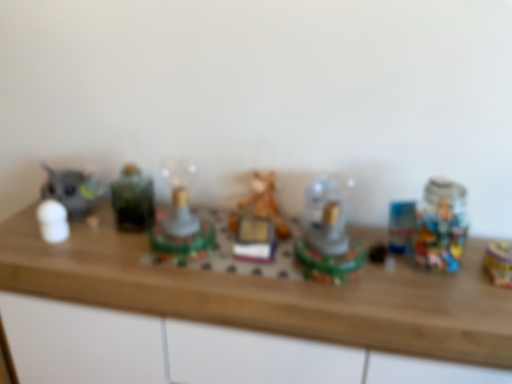
Measure the distance between matte gray cat at left, the second toy in the left-to-right sequence, and camera.

The depth of matte gray cat at left, the second toy in the left-to-right sequence, is 1.33 meters.

This screenshot has height=384, width=512. What do you see at coordinates (258, 221) in the screenshot?
I see `orange plush bear at center, which is the 5th toy from left to right` at bounding box center [258, 221].

Locate an element on the screen. This screenshot has width=512, height=384. translucent plastic toy at center, which is counted as the sixth toy, starting from the left is located at coordinates (327, 234).

What do you see at coordinates (180, 220) in the screenshot? I see `shiny green plastic toy at center, arranged as the fourth toy when viewed from the left` at bounding box center [180, 220].

Where is `green glass jar at left, placed as the 3th toy when sorted from left to right`? The width and height of the screenshot is (512, 384). green glass jar at left, placed as the 3th toy when sorted from left to right is located at coordinates (133, 199).

Relative to white matte figurine at left, the seventh toy in the right-to-left sequence, is green glass jar at left, the fifth toy from the right, in front or behind?

Clearly, green glass jar at left, the fifth toy from the right, is behind white matte figurine at left, the seventh toy in the right-to-left sequence.

Is green glass jar at left, the fifth toy from the right, not near white matte figurine at left, the first toy positioned from the left?

No, there isn't a large distance between green glass jar at left, the fifth toy from the right, and white matte figurine at left, the first toy positioned from the left.

Considering the relative sizes of green glass jar at left, placed as the 3th toy when sorted from left to right, and white matte figurine at left, the seventh toy in the right-to-left sequence, in the image provided, is green glass jar at left, placed as the 3th toy when sorted from left to right, bigger than white matte figurine at left, the seventh toy in the right-to-left sequence,?

Indeed, green glass jar at left, placed as the 3th toy when sorted from left to right, has a larger size compared to white matte figurine at left, the seventh toy in the right-to-left sequence.

In the scene shown: From the image's perspective, between green glass jar at left, placed as the 3th toy when sorted from left to right, and white matte figurine at left, the seventh toy in the right-to-left sequence, who is located below?

From the image's view, white matte figurine at left, the seventh toy in the right-to-left sequence, is below.

How far apart are orange plush bear at center, the third toy from the right, and gold metallic toy at right, which ranks as the 1th toy in right-to-left order?

orange plush bear at center, the third toy from the right, and gold metallic toy at right, which ranks as the 1th toy in right-to-left order, are 58.51 centimeters apart.

Is orange plush bear at center, which is the 5th toy from left to right, in front of gold metallic toy at right, the 7th toy positioned from the left?

No, orange plush bear at center, which is the 5th toy from left to right, is further to the viewer.

Is gold metallic toy at right, which ranks as the 1th toy in right-to-left order, inside orange plush bear at center, the third toy from the right?

No.

This screenshot has height=384, width=512. In order to click on the 3rd toy in front when counting from the orange plush bear at center, the third toy from the right in this screenshot , I will do `click(499, 262)`.

Is shiny green plastic toy at center, arranged as the fourth toy when viewed from the left, not inside translucent plastic toy at center, marked as the 2th toy in a right-to-left arrangement?

shiny green plastic toy at center, arranged as the fourth toy when viewed from the left, is positioned outside translucent plastic toy at center, marked as the 2th toy in a right-to-left arrangement.

How far apart are shiny green plastic toy at center, marked as the fourth toy in a right-to-left arrangement, and translucent plastic toy at center, marked as the 2th toy in a right-to-left arrangement?

shiny green plastic toy at center, marked as the fourth toy in a right-to-left arrangement, is 12.56 inches from translucent plastic toy at center, marked as the 2th toy in a right-to-left arrangement.

Can you tell me how much shiny green plastic toy at center, marked as the fourth toy in a right-to-left arrangement, and translucent plastic toy at center, marked as the 2th toy in a right-to-left arrangement, differ in facing direction?

They differ by 0.000123 degrees in their facing directions.

Does point (170, 166) come closer to viewer compared to point (335, 200)?

That is False.

From the image's perspective, is matte gray cat at left, the second toy in the left-to-right sequence, positioned above or below translucent plastic toy at center, marked as the 2th toy in a right-to-left arrangement?

matte gray cat at left, the second toy in the left-to-right sequence, is situated higher than translucent plastic toy at center, marked as the 2th toy in a right-to-left arrangement, in the image.

Is translucent plastic toy at center, marked as the 2th toy in a right-to-left arrangement, at the back of matte gray cat at left, the second toy in the left-to-right sequence?

No, matte gray cat at left, the second toy in the left-to-right sequence, is not facing away from translucent plastic toy at center, marked as the 2th toy in a right-to-left arrangement.

Would you say matte gray cat at left, the second toy in the left-to-right sequence, is a long distance from translucent plastic toy at center, marked as the 2th toy in a right-to-left arrangement?

No.

Is point (504, 260) positioned behind point (49, 217)?

That is False.

Is gold metallic toy at right, the 7th toy positioned from the left, positioned far away from white matte figurine at left, the first toy positioned from the left?

Indeed, gold metallic toy at right, the 7th toy positioned from the left, is not near white matte figurine at left, the first toy positioned from the left.

Between gold metallic toy at right, the 7th toy positioned from the left, and white matte figurine at left, the seventh toy in the right-to-left sequence, which one has larger width?

gold metallic toy at right, the 7th toy positioned from the left, is wider.

Considering the relative sizes of gold metallic toy at right, the 7th toy positioned from the left, and white matte figurine at left, the first toy positioned from the left, in the image provided, is gold metallic toy at right, the 7th toy positioned from the left, smaller than white matte figurine at left, the first toy positioned from the left,?

Yes, gold metallic toy at right, the 7th toy positioned from the left, is smaller than white matte figurine at left, the first toy positioned from the left.

From a real-world perspective, is green glass jar at left, the fifth toy from the right, beneath gold metallic toy at right, which ranks as the 1th toy in right-to-left order?

Incorrect, from a real-world perspective, green glass jar at left, the fifth toy from the right, is higher than gold metallic toy at right, which ranks as the 1th toy in right-to-left order.

Considering the relative sizes of green glass jar at left, the fifth toy from the right, and gold metallic toy at right, which ranks as the 1th toy in right-to-left order, in the image provided, is green glass jar at left, the fifth toy from the right, wider than gold metallic toy at right, which ranks as the 1th toy in right-to-left order,?

No, green glass jar at left, the fifth toy from the right, is not wider than gold metallic toy at right, which ranks as the 1th toy in right-to-left order.

In the scene shown: Which of these two, green glass jar at left, placed as the 3th toy when sorted from left to right, or gold metallic toy at right, the 7th toy positioned from the left, is smaller?

gold metallic toy at right, the 7th toy positioned from the left, is smaller.

Is orange plush bear at center, which is the 5th toy from left to right, surrounded by shiny green plastic toy at center, marked as the fourth toy in a right-to-left arrangement?

No, orange plush bear at center, which is the 5th toy from left to right, is not a part of shiny green plastic toy at center, marked as the fourth toy in a right-to-left arrangement.

Does shiny green plastic toy at center, marked as the fourth toy in a right-to-left arrangement, turn towards orange plush bear at center, which is the 5th toy from left to right?

No, shiny green plastic toy at center, marked as the fourth toy in a right-to-left arrangement, is not turned towards orange plush bear at center, which is the 5th toy from left to right.

Are shiny green plastic toy at center, marked as the fourth toy in a right-to-left arrangement, and orange plush bear at center, the third toy from the right, beside each other?

No, shiny green plastic toy at center, marked as the fourth toy in a right-to-left arrangement, is not making contact with orange plush bear at center, the third toy from the right.

Identify the location of toy that is the 1st one above the orange plush bear at center, which is the 5th toy from left to right (from a real-world perspective). (180, 220).

Starting from the green glass jar at left, placed as the 3th toy when sorted from left to right, which toy is the 2nd one in front? Please provide its 2D coordinates.

[(53, 221)]

The image size is (512, 384). What are the coordinates of `the 3rd toy behind the gold metallic toy at right, the 7th toy positioned from the left` in the screenshot? It's located at (258, 221).

From the picture: Considering their positions, is gold metallic toy at right, the 7th toy positioned from the left, positioned further to orange plush bear at center, the third toy from the right, than shiny green plastic toy at center, arranged as the fourth toy when viewed from the left?

gold metallic toy at right, the 7th toy positioned from the left, is further to orange plush bear at center, the third toy from the right.

Looking at this image, considering their positions, is gold metallic toy at right, the 7th toy positioned from the left, positioned further to matte gray cat at left, the sixth toy in the right-to-left sequence, than white matte figurine at left, the first toy positioned from the left?

gold metallic toy at right, the 7th toy positioned from the left, is further to matte gray cat at left, the sixth toy in the right-to-left sequence.

Considering their positions, is shiny green plastic toy at center, arranged as the fourth toy when viewed from the left, positioned closer to green glass jar at left, placed as the 3th toy when sorted from left to right, than translucent plastic toy at center, which is counted as the sixth toy, starting from the left?

shiny green plastic toy at center, arranged as the fourth toy when viewed from the left, is closer to green glass jar at left, placed as the 3th toy when sorted from left to right.

Estimate the real-world distances between objects in this image. Which object is further from green glass jar at left, the fifth toy from the right, white matte figurine at left, the seventh toy in the right-to-left sequence, or translucent plastic toy at center, which is counted as the sixth toy, starting from the left?

translucent plastic toy at center, which is counted as the sixth toy, starting from the left, lies further to green glass jar at left, the fifth toy from the right, than the other object.

Which object lies nearer to the anchor point white matte figurine at left, the seventh toy in the right-to-left sequence, wooden counter top at center or matte gray cat at left, the second toy in the left-to-right sequence?

Among the two, matte gray cat at left, the second toy in the left-to-right sequence, is located nearer to white matte figurine at left, the seventh toy in the right-to-left sequence.

Considering their positions, is matte gray cat at left, the sixth toy in the right-to-left sequence, positioned closer to translucent plastic toy at center, which is counted as the sixth toy, starting from the left, than orange plush bear at center, which is the 5th toy from left to right?

Based on the image, orange plush bear at center, which is the 5th toy from left to right, appears to be nearer to translucent plastic toy at center, which is counted as the sixth toy, starting from the left.

Based on their spatial positions, is wooden counter top at center or matte gray cat at left, the sixth toy in the right-to-left sequence, further from orange plush bear at center, which is the 5th toy from left to right?

matte gray cat at left, the sixth toy in the right-to-left sequence, is positioned further to the anchor orange plush bear at center, which is the 5th toy from left to right.

Which object lies further to the anchor point gold metallic toy at right, the 7th toy positioned from the left, wooden counter top at center or orange plush bear at center, which is the 5th toy from left to right?

Based on the image, orange plush bear at center, which is the 5th toy from left to right, appears to be further to gold metallic toy at right, the 7th toy positioned from the left.

Image resolution: width=512 pixels, height=384 pixels. In order to click on toy located between matte gray cat at left, the sixth toy in the right-to-left sequence, and shiny green plastic toy at center, arranged as the fourth toy when viewed from the left, in the left-right direction in this screenshot , I will do `click(133, 199)`.

I want to click on toy situated between white matte figurine at left, the seventh toy in the right-to-left sequence, and green glass jar at left, the fifth toy from the right, from left to right, so click(x=72, y=190).

Identify the location of counter top located between white matte figurine at left, the seventh toy in the right-to-left sequence, and orange plush bear at center, the third toy from the right, in the left-right direction. This screenshot has height=384, width=512. (269, 294).

Locate an element on the screen. Image resolution: width=512 pixels, height=384 pixels. counter top between white matte figurine at left, the seventh toy in the right-to-left sequence, and gold metallic toy at right, the 7th toy positioned from the left, from left to right is located at coordinates (269, 294).